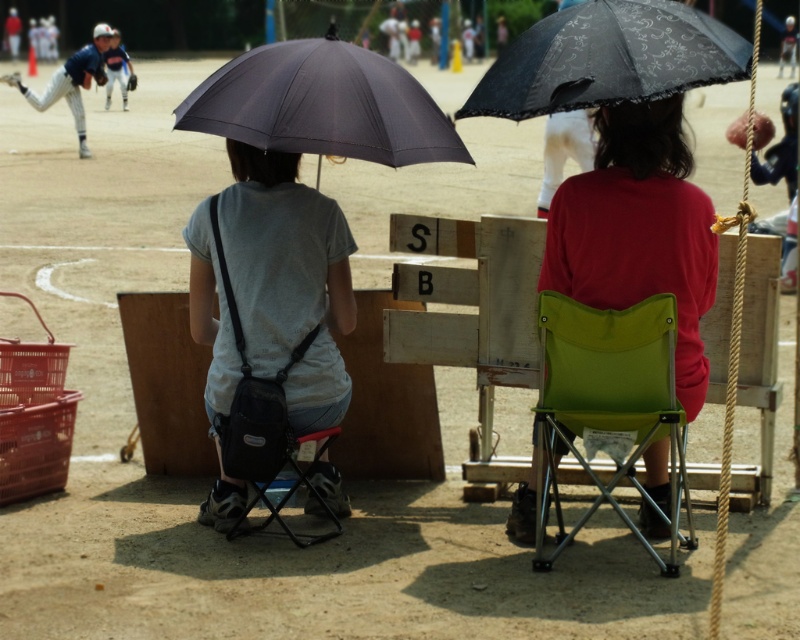
Is black matte umbrella at center positioned at the back of white fabric umbrella at upper center?

That is False.

What do you see at coordinates (322, 104) in the screenshot? I see `black matte umbrella at center` at bounding box center [322, 104].

Identify the location of black matte umbrella at center. (322, 104).

Does black lace umbrella at upper center appear on the left side of matte blue baseball glove at upper left?

No, black lace umbrella at upper center is not to the left of matte blue baseball glove at upper left.

Which is more to the right, black lace umbrella at upper center or matte blue baseball glove at upper left?

From the viewer's perspective, black lace umbrella at upper center appears more on the right side.

Identify the location of black lace umbrella at upper center. This screenshot has height=640, width=800. (608, 58).

Does green fabric folding chair at center have a greater width compared to white fabric umbrella at upper center?

Correct, the width of green fabric folding chair at center exceeds that of white fabric umbrella at upper center.

Is green fabric folding chair at center smaller than white fabric umbrella at upper center?

Correct, green fabric folding chair at center occupies less space than white fabric umbrella at upper center.

The height and width of the screenshot is (640, 800). What are the coordinates of `green fabric folding chair at center` in the screenshot? It's located at (606, 394).

Find the location of `green fabric folding chair at center`. green fabric folding chair at center is located at coordinates pos(606,394).